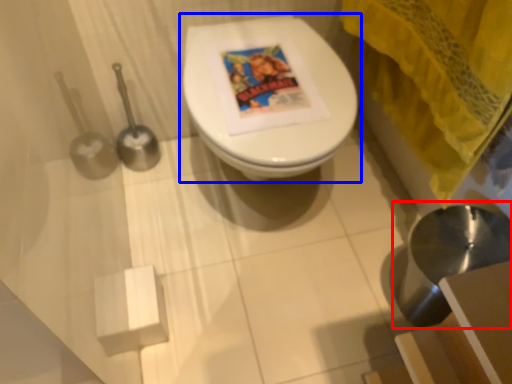
Question: Which of the following is the closest to the observer, sink (highlighted by a red box) or toilet (highlighted by a blue box)?

Choices:
 (A) sink
 (B) toilet

Answer: (A)